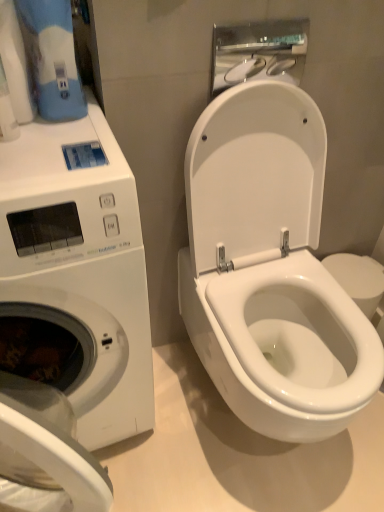
Question: Does white glossy washing machine at left come in front of white glossy hand dryer at upper center?

Choices:
 (A) yes
 (B) no

Answer: (A)

Question: From a real-world perspective, does white glossy washing machine at left sit lower than white glossy hand dryer at upper center?

Choices:
 (A) no
 (B) yes

Answer: (B)

Question: Does white glossy washing machine at left have a lesser height compared to white glossy hand dryer at upper center?

Choices:
 (A) no
 (B) yes

Answer: (A)

Question: From the image's perspective, would you say white glossy washing machine at left is positioned over white glossy hand dryer at upper center?

Choices:
 (A) yes
 (B) no

Answer: (B)

Question: Are white glossy washing machine at left and white glossy hand dryer at upper center making contact?

Choices:
 (A) no
 (B) yes

Answer: (A)

Question: From their relative heights in the image, would you say white glossy hand dryer at upper center is taller or shorter than white glossy toilet at center?

Choices:
 (A) tall
 (B) short

Answer: (B)

Question: In terms of width, does white glossy hand dryer at upper center look wider or thinner when compared to white glossy toilet at center?

Choices:
 (A) thin
 (B) wide

Answer: (A)

Question: Is point (264, 38) positioned closer to the camera than point (213, 229)?

Choices:
 (A) farther
 (B) closer

Answer: (B)

Question: From a real-world perspective, relative to white glossy toilet at center, is white glossy hand dryer at upper center vertically above or below?

Choices:
 (A) below
 (B) above

Answer: (B)

Question: Is white glossy toilet at center wider or thinner than white glossy hand dryer at upper center?

Choices:
 (A) wide
 (B) thin

Answer: (A)

Question: Is white glossy toilet at center taller or shorter than white glossy hand dryer at upper center?

Choices:
 (A) short
 (B) tall

Answer: (B)

Question: Considering the positions of point (226, 156) and point (243, 51), is point (226, 156) closer or farther from the camera than point (243, 51)?

Choices:
 (A) farther
 (B) closer

Answer: (B)

Question: Considering the positions of white glossy toilet at center and white glossy hand dryer at upper center in the image, is white glossy toilet at center bigger or smaller than white glossy hand dryer at upper center?

Choices:
 (A) big
 (B) small

Answer: (A)

Question: Is white glossy toilet at center bigger or smaller than white glossy toilet paper at upper left?

Choices:
 (A) small
 (B) big

Answer: (B)

Question: From their relative heights in the image, would you say white glossy toilet at center is taller or shorter than white glossy toilet paper at upper left?

Choices:
 (A) short
 (B) tall

Answer: (B)